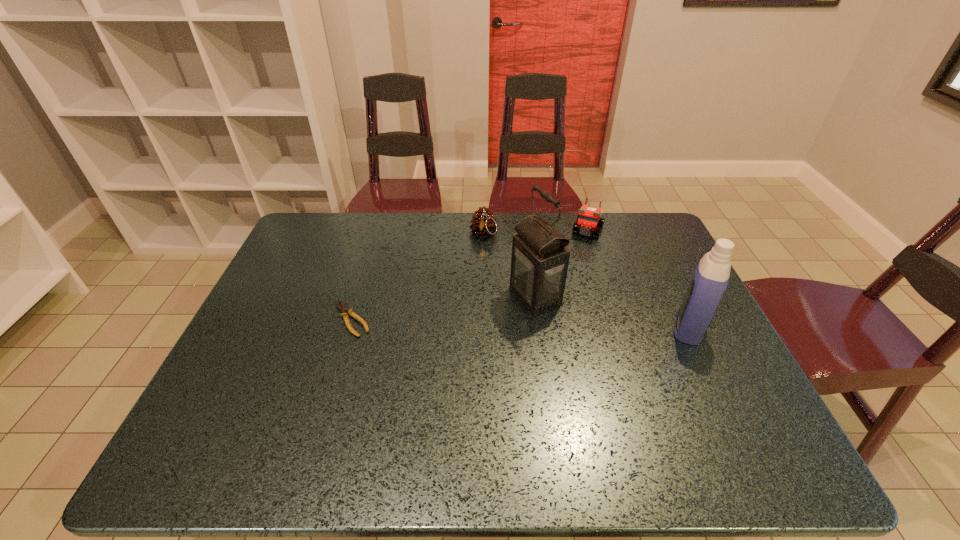
This screenshot has height=540, width=960. Find the location of `vacant space on the desktop that is between the shortest object and the rightmost object and is positioned on the front-facing side of the second object from right to left`. vacant space on the desktop that is between the shortest object and the rightmost object and is positioned on the front-facing side of the second object from right to left is located at coordinates tap(548, 324).

What are the coordinates of `vacant space on the desktop that is between the shortest object and the rightmost object and is positioned on the front-facing side of the lantern` in the screenshot? It's located at (470, 322).

The image size is (960, 540). In order to click on vacant spot on the desktop that is between the shortest object and the rightmost object and is positioned with a leaf charm attached to the second object from left to right in this screenshot , I will do point(486,322).